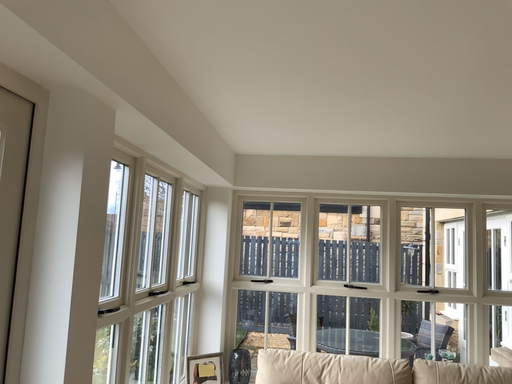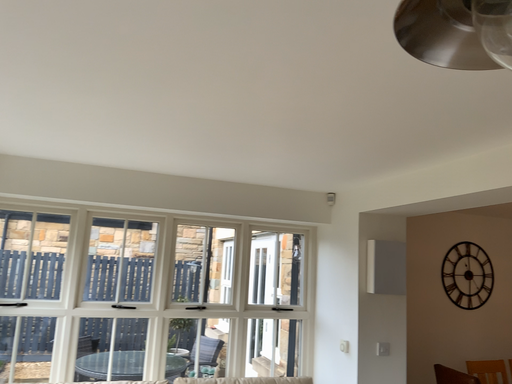
Question: How did the camera likely rotate when shooting the video?

Choices:
 (A) rotated right
 (B) rotated left

Answer: (A)